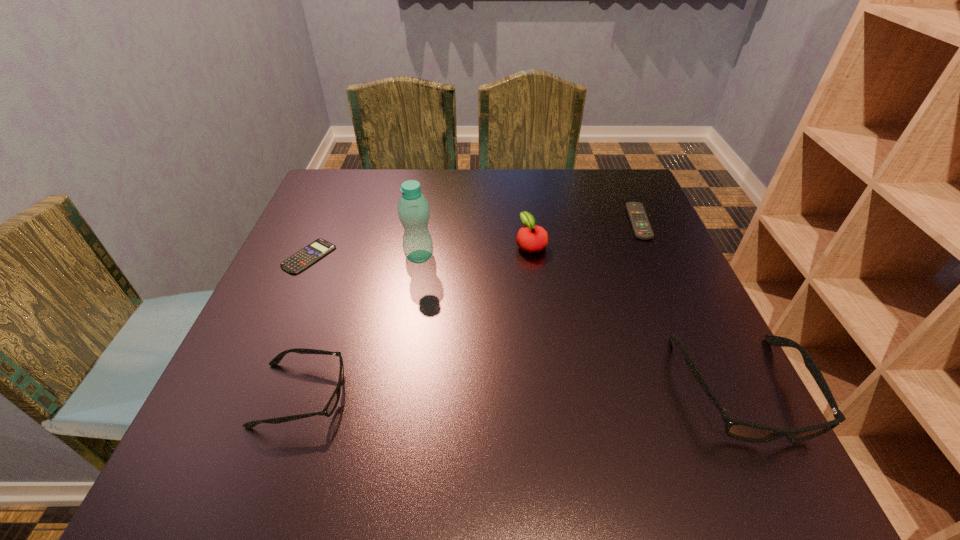
Where is `vacant space that satisfies the following two spatial constraints: 1. on the back side of the remote control; 2. on the left side of the apple`? vacant space that satisfies the following two spatial constraints: 1. on the back side of the remote control; 2. on the left side of the apple is located at coordinates point(528,222).